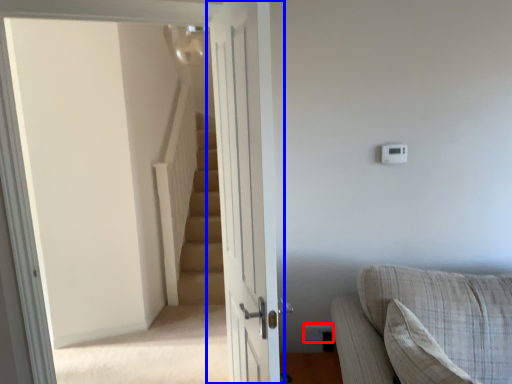
Question: Among these objects, which one is nearest to the camera, electric outlet (highlighted by a red box) or door (highlighted by a blue box)?

Choices:
 (A) electric outlet
 (B) door

Answer: (B)